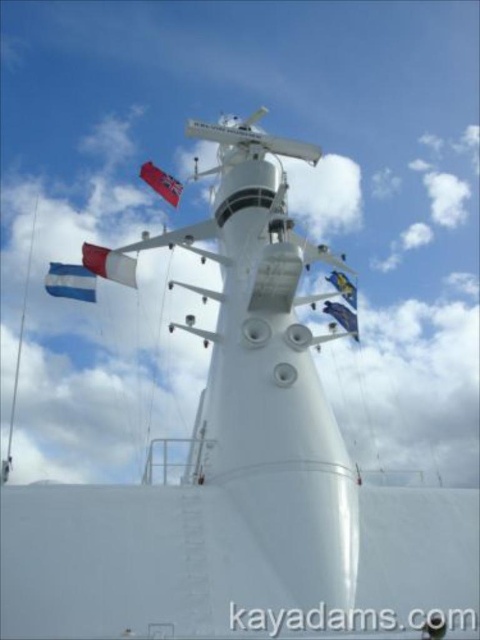
You are a sailor on the ship and need to determine which flag has a greater width between the red fabric flag at upper center and the blue fabric flag at upper center. Based on your observation from below the mast, which one is wider?

The red fabric flag at upper center is wider than the blue fabric flag at upper center.